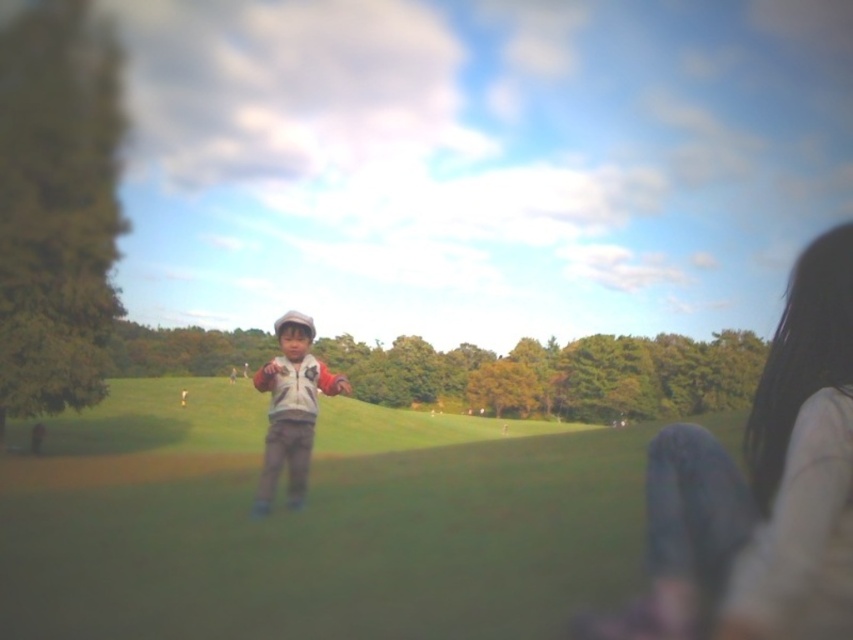
Does denim pants at lower right have a greater height compared to matte gray jacket at center?

No.

Who is taller, denim pants at lower right or matte gray jacket at center?

matte gray jacket at center is taller.

Looking at this image, who is more distant from viewer, (672,460) or (296,488)?

The point (296,488) is more distant.

Find the location of a particular element. denim pants at lower right is located at coordinates (753, 477).